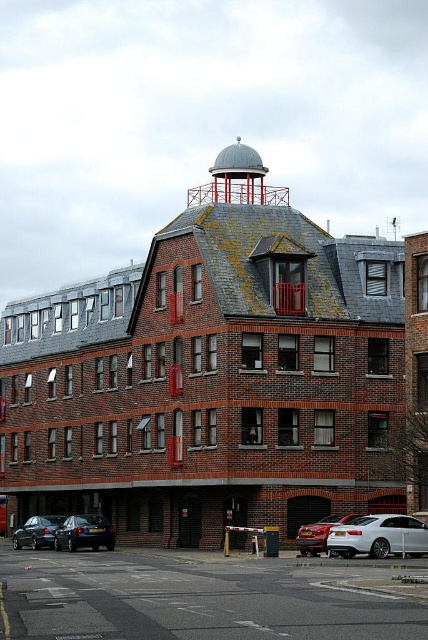
Is silver metallic sedan at lower right bigger than satin silver car at lower right?

Actually, silver metallic sedan at lower right might be smaller than satin silver car at lower right.

Is point (344, 529) positioned before point (309, 550)?

Yes, it is.

This screenshot has width=428, height=640. What are the coordinates of `silver metallic sedan at lower right` in the screenshot? It's located at (379, 536).

Who is lower down, shiny black car at lower left or shiny black sedan at lower left?

shiny black sedan at lower left is lower down.

Consider the image. Which is more to the right, shiny black car at lower left or shiny black sedan at lower left?

From the viewer's perspective, shiny black car at lower left appears more on the right side.

The width and height of the screenshot is (428, 640). Identify the location of shiny black car at lower left. (x=85, y=532).

Is shiny black sedan at lower left thinner than satin silver car at lower right?

Incorrect, shiny black sedan at lower left's width is not less than satin silver car at lower right's.

What do you see at coordinates (36, 531) in the screenshot? I see `shiny black sedan at lower left` at bounding box center [36, 531].

Who is more forward, (41, 545) or (311, 547)?

Point (311, 547) is more forward.

I want to click on shiny black sedan at lower left, so click(x=36, y=531).